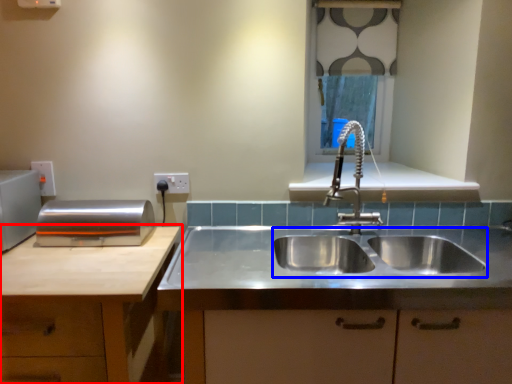
Question: Which of the following is the closest to the observer, cabinetry (highlighted by a red box) or sink (highlighted by a blue box)?

Choices:
 (A) cabinetry
 (B) sink

Answer: (A)